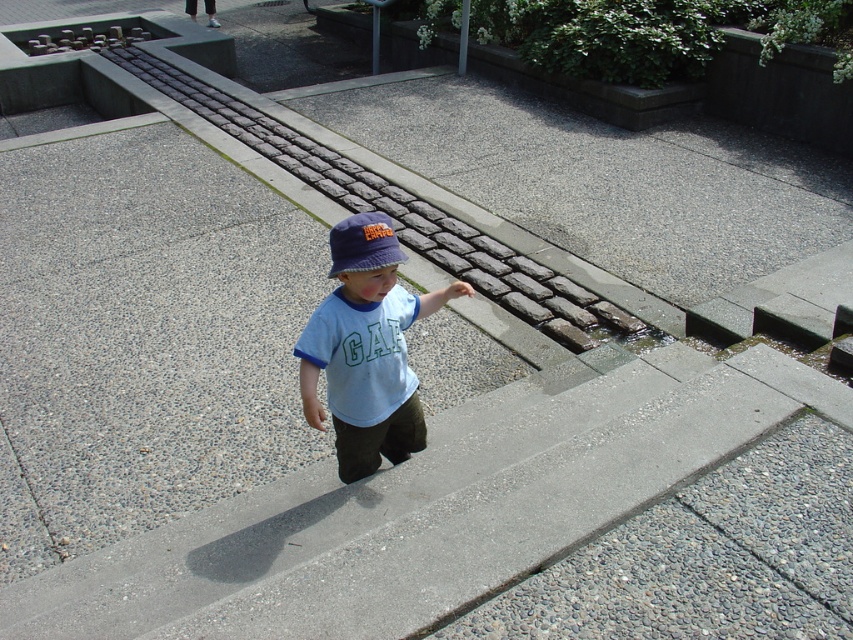
Question: Does light blue cotton shirt at center lie in front of blue fabric baseball hat at center?

Choices:
 (A) yes
 (B) no

Answer: (A)

Question: Which of the following is the farthest from the observer?

Choices:
 (A) (349, 244)
 (B) (358, 253)

Answer: (A)

Question: Which point is closer to the camera taking this photo?

Choices:
 (A) (374, 232)
 (B) (390, 388)

Answer: (A)

Question: Is light blue cotton shirt at center to the left of blue fabric baseball hat at center from the viewer's perspective?

Choices:
 (A) yes
 (B) no

Answer: (A)

Question: Can you confirm if light blue cotton shirt at center is wider than blue fabric baseball hat at center?

Choices:
 (A) no
 (B) yes

Answer: (B)

Question: Which object is closer to the camera taking this photo?

Choices:
 (A) light blue cotton shirt at center
 (B) blue fabric baseball hat at center

Answer: (A)